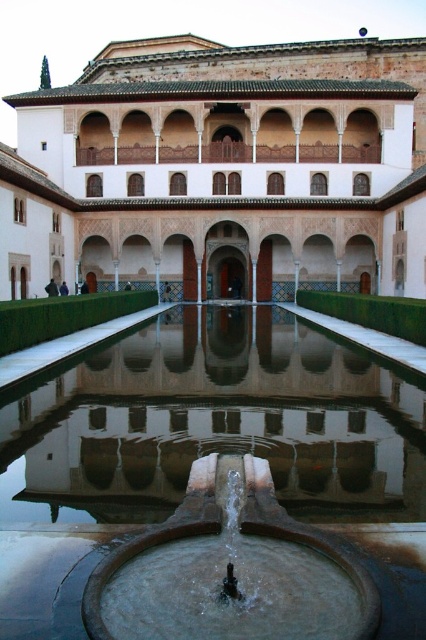
At what (x,y) coordinates should I click in order to perform the action: click on stone wall at center. Please return your answer as a coordinate pair (x, y). The image size is (426, 640). Looking at the image, I should click on (221, 168).

How far apart are stone wall at center and bronze metallic fountain at center?

stone wall at center and bronze metallic fountain at center are 71.70 meters apart.

Based on the photo, who is more distant from viewer, (417, 161) or (224, 563)?

The point (417, 161) is more distant.

In order to click on stone wall at center in this screenshot , I will do `click(221, 168)`.

Is brown stone fountain at center positioned behind bronze metallic fountain at center?

Yes, brown stone fountain at center is further from the viewer.

Which is below, brown stone fountain at center or bronze metallic fountain at center?

bronze metallic fountain at center is lower down.

Where is `brown stone fountain at center`? The height and width of the screenshot is (640, 426). brown stone fountain at center is located at coordinates pyautogui.click(x=215, y=426).

Who is lower down, stone wall at center or brown stone fountain at center?

brown stone fountain at center is lower down.

What do you see at coordinates (221, 168) in the screenshot? I see `stone wall at center` at bounding box center [221, 168].

This screenshot has height=640, width=426. In order to click on stone wall at center in this screenshot , I will do `click(221, 168)`.